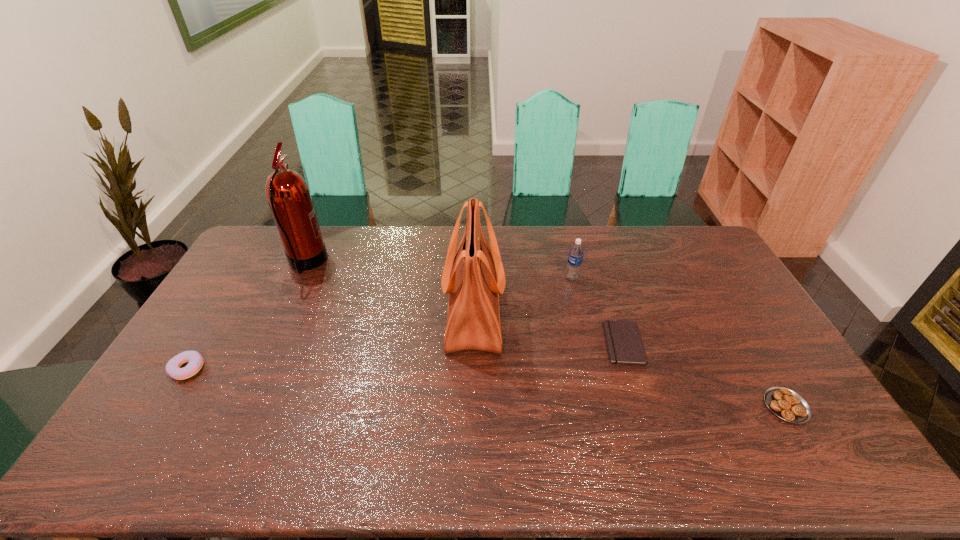
The width and height of the screenshot is (960, 540). Find the location of `free space that satisfies the following two spatial constraints: 1. on the front-facing side of the rightmost object; 2. on the left side of the tallest object`. free space that satisfies the following two spatial constraints: 1. on the front-facing side of the rightmost object; 2. on the left side of the tallest object is located at coordinates (240, 406).

Image resolution: width=960 pixels, height=540 pixels. Find the location of `vacant space that satisfies the following two spatial constraints: 1. on the front-facing side of the tallest object; 2. on the back side of the shortest object`. vacant space that satisfies the following two spatial constraints: 1. on the front-facing side of the tallest object; 2. on the back side of the shortest object is located at coordinates (269, 343).